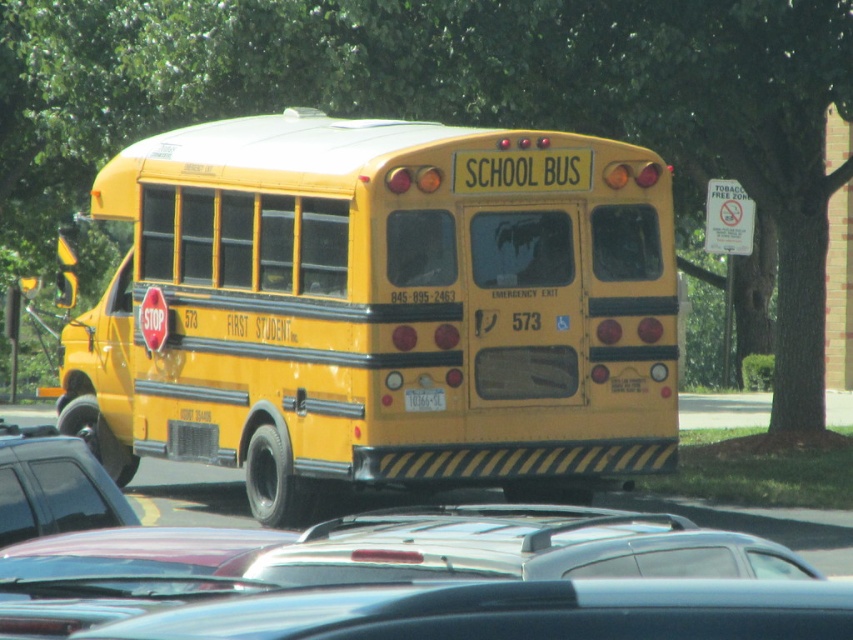
You are a delivery person who needs to load a package onto the roof of the metallic gray sedan at center. The package is 1.2 meters tall. Can you safely place it there without exceeding the height limit imposed by the yellow matte license plate at center?

The metallic gray sedan at center is much taller than the yellow matte license plate at center, so placing a 1.2 meter tall package on its roof would exceed the height limit imposed by the yellow matte license plate at center. You should not place it there.

You are standing at a point 60 feet away from the camera. You want to walk towards the camera until you reach the point marked as point [148,150]. How many more feet do you need to walk?

The point [148,150] is 58.34 feet away from the camera. Since you are currently 60 feet away, you need to walk 1.66 feet forward to reach it.